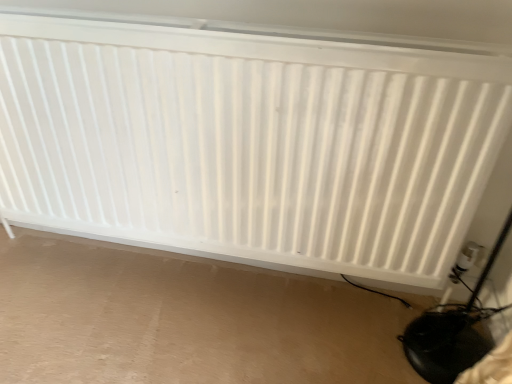
At what (x,y) coordinates should I click in order to perform the action: click on white matte radiator at center. Please return your answer as a coordinate pair (x, y). The width and height of the screenshot is (512, 384). Looking at the image, I should click on (249, 143).

The height and width of the screenshot is (384, 512). Describe the element at coordinates (249, 143) in the screenshot. I see `white matte radiator at center` at that location.

The image size is (512, 384). I want to click on white matte radiator at center, so click(x=249, y=143).